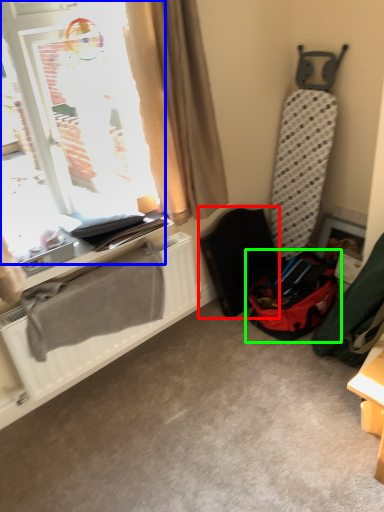
Question: Which is farther away from folding chair (highlighted by a red box)? window (highlighted by a blue box) or luggage and bags (highlighted by a green box)?

Choices:
 (A) window
 (B) luggage and bags

Answer: (A)